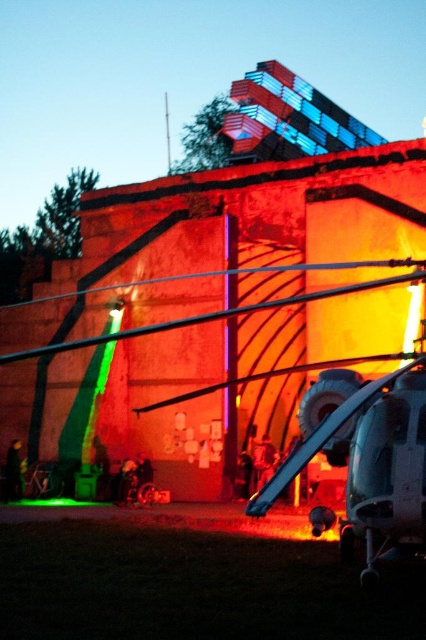
Based on the photo, you are a photographer standing at the base of the building. You notice a dark green fabric jacket at lower left and a smooth skin person at center. Which object is closer to the bottom of the image?

The dark green fabric jacket at lower left is closer to the bottom of the image because it is located below the smooth skin person at center.

You are a photographer trying to capture a portrait of the smooth skin person at center without including the dark green fabric jacket at lower left in the frame. Based on their positions, is it possible to position yourself so that the jacket is completely out of the shot?

The dark green fabric jacket at lower left might be wider than the smooth skin person at center, so there is a possibility that the jacket could block part of the person. To ensure the jacket is out of the frame, you might need to adjust your angle or move closer to the person to avoid the jacket overlapping.